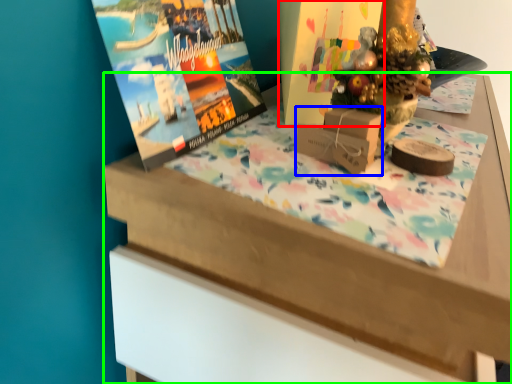
Question: Which is farther away from book cover (highlighted by a red box)? cardboard box (highlighted by a blue box) or table (highlighted by a green box)?

Choices:
 (A) cardboard box
 (B) table

Answer: (B)